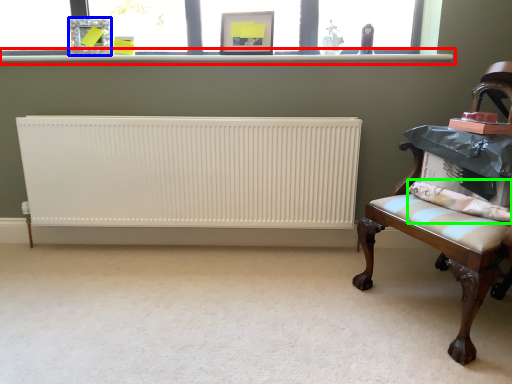
Question: Which is nearer to the window sill (highlighted by a red box)? picture frame (highlighted by a blue box) or pillow (highlighted by a green box).

Choices:
 (A) picture frame
 (B) pillow

Answer: (A)